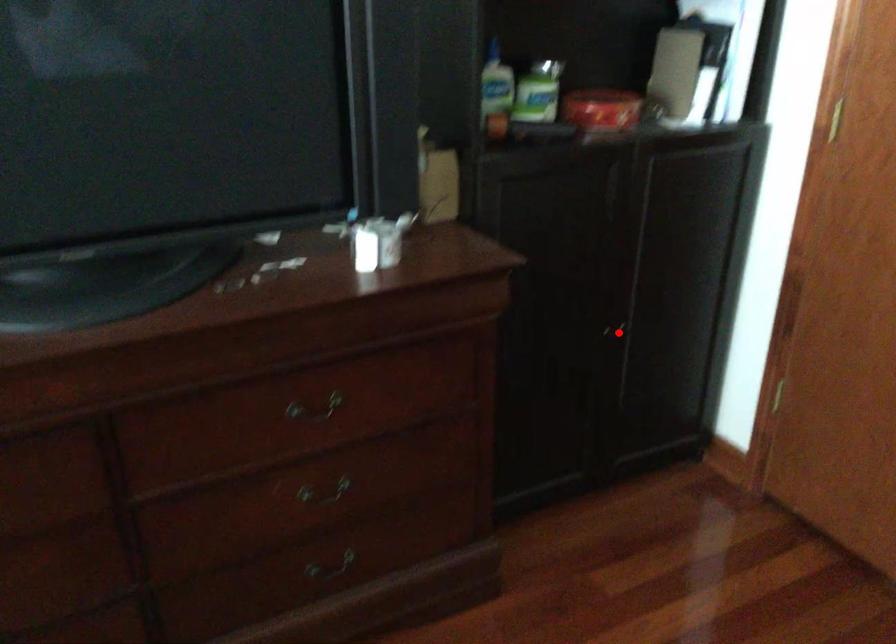
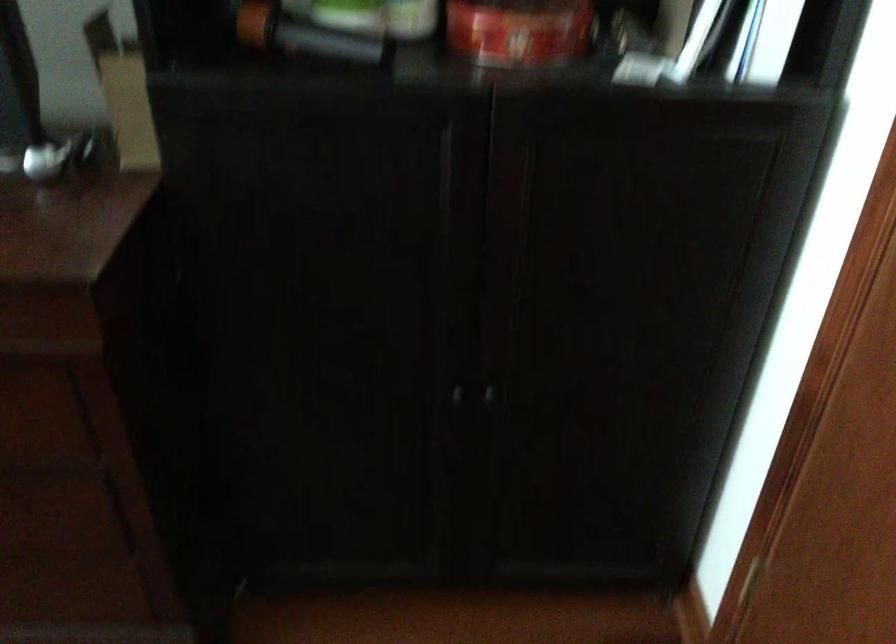
Question: I am providing you with two images of the same scene from different viewpoints. Image1 has a red point marked. In image2, the corresponding 3D location appears at what relative position? Reply with the corresponding letter.

Choices:
 (A) Closer
 (B) Farther

Answer: (A)